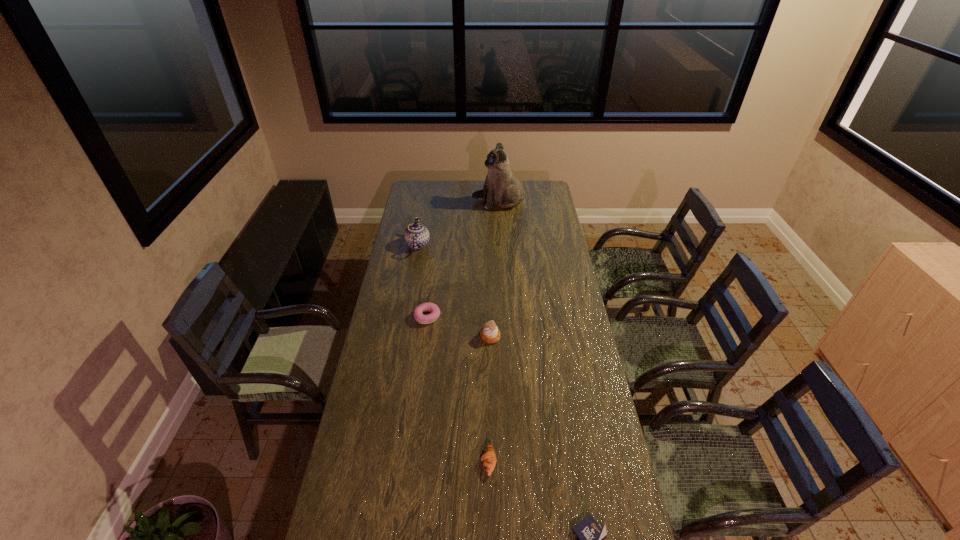
I want to click on the tallest object, so click(x=502, y=187).

This screenshot has height=540, width=960. Find the location of `the farthest object`. the farthest object is located at coordinates point(502,187).

Locate an element on the screen. the fifth nearest object is located at coordinates (416, 236).

This screenshot has width=960, height=540. I want to click on the second tallest object, so click(416, 236).

This screenshot has height=540, width=960. Identify the location of the tallest pastry. (489, 333).

I want to click on the fourth farthest object, so click(x=489, y=333).

Locate an element on the screen. The width and height of the screenshot is (960, 540). the leftmost pastry is located at coordinates (418, 312).

This screenshot has height=540, width=960. I want to click on the farthest pastry, so click(x=418, y=312).

The height and width of the screenshot is (540, 960). Identify the location of the fifth farthest object. (489, 460).

Where is `vacant space situated 0.110m at the face of the farthest object`? This screenshot has width=960, height=540. vacant space situated 0.110m at the face of the farthest object is located at coordinates (454, 202).